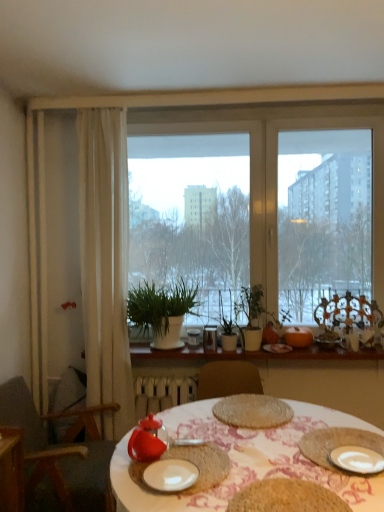
You are a GUI agent. You are given a task and a screenshot of the screen. Output one action in this format:
    pyautogui.click(x=<x>, y=<y>)
    Task: Click on the vacant area on the back side of matte red teapot at center, which is the second tableware in left-to-right order
    
    Given the screenshot: What is the action you would take?
    pyautogui.click(x=188, y=428)